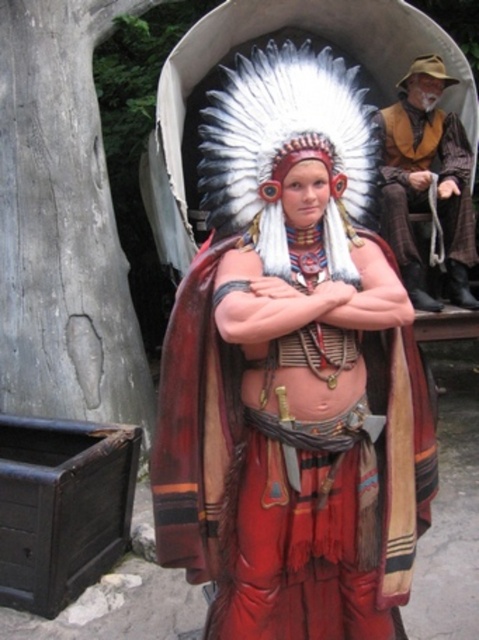
What is located at the coordinates point (x=293, y=369) in the image?

The point (x=293, y=369) corresponds to the matte red fabric at center.

Based on the scene description, which object is taller between the matte red fabric at center and the leather vest at upper right?

The matte red fabric at center is taller than the leather vest at upper right according to the description.